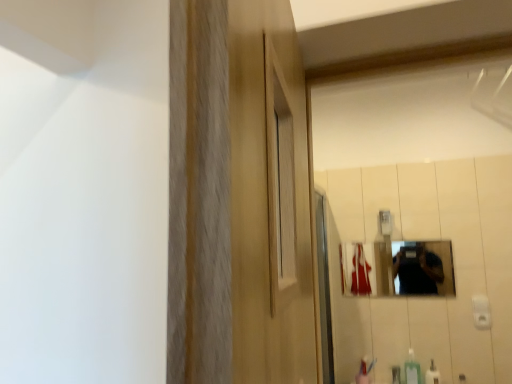
Measure the distance between point (435, 373) and camera.

The distance of point (435, 373) from camera is 2.25 meters.

Describe the element at coordinates (412, 369) in the screenshot. I see `green plastic soap dispenser at lower right` at that location.

Describe the element at coordinates (423, 268) in the screenshot. I see `metallic reflective mirror at center` at that location.

The height and width of the screenshot is (384, 512). Find the location of `white glossy bottle at lower right`. white glossy bottle at lower right is located at coordinates (432, 374).

Which of these two, white glossy bottle at lower right or metallic reflective mirror at center, is bigger?

Bigger between the two is metallic reflective mirror at center.

What's the angular difference between white glossy bottle at lower right and metallic reflective mirror at center's facing directions?

There is a 0.397-degree angle between the facing directions of white glossy bottle at lower right and metallic reflective mirror at center.

Is white glossy bottle at lower right at the left side of metallic reflective mirror at center?

Incorrect, white glossy bottle at lower right is not on the left side of metallic reflective mirror at center.

This screenshot has height=384, width=512. What are the coordinates of `mouthwash that is on the right side of metallic reflective mirror at center` in the screenshot? It's located at pos(432,374).

Could you measure the distance between metallic reflective mirror at center and green plastic soap dispenser at lower right?

17.81 inches.

From a real-world perspective, relative to green plastic soap dispenser at lower right, is metallic reflective mirror at center vertically above or below?

metallic reflective mirror at center is above green plastic soap dispenser at lower right.

Looking at this image, how different are the orientations of metallic reflective mirror at center and green plastic soap dispenser at lower right in degrees?

metallic reflective mirror at center and green plastic soap dispenser at lower right are facing 0.397 degrees away from each other.

Between metallic reflective mirror at center and green plastic soap dispenser at lower right, which one appears on the left side from the viewer's perspective?

metallic reflective mirror at center.

Between green plastic soap dispenser at lower right and white glossy bottle at lower right, which one has larger width?

With larger width is white glossy bottle at lower right.

Which is closer, (416, 373) or (435, 374)?

The point (416, 373) is closer.

From the image's perspective, between green plastic soap dispenser at lower right and white glossy bottle at lower right, which one is located above?

green plastic soap dispenser at lower right appears higher in the image.

From the image's perspective, between green plastic soap dispenser at lower right and metallic reflective mirror at center, which one is located above?

From the image's view, metallic reflective mirror at center is above.

Is green plastic soap dispenser at lower right turned away from metallic reflective mirror at center?

green plastic soap dispenser at lower right is not turned away from metallic reflective mirror at center.

From a real-world perspective, who is located lower, green plastic soap dispenser at lower right or metallic reflective mirror at center?

green plastic soap dispenser at lower right.

Measure the distance from green plastic soap dispenser at lower right to metallic reflective mirror at center.

green plastic soap dispenser at lower right is 17.81 inches from metallic reflective mirror at center.

Is white glossy bottle at lower right directly adjacent to green plastic soap dispenser at lower right?

Yes, white glossy bottle at lower right is with green plastic soap dispenser at lower right.

Is green plastic soap dispenser at lower right at the back of white glossy bottle at lower right?

No.

What's the angular difference between white glossy bottle at lower right and green plastic soap dispenser at lower right's facing directions?

The angle between the facing direction of white glossy bottle at lower right and the facing direction of green plastic soap dispenser at lower right is 0.00294 degrees.

From the image's perspective, between white glossy bottle at lower right and green plastic soap dispenser at lower right, who is located below?

white glossy bottle at lower right, from the image's perspective.

Would you say metallic reflective mirror at center contains white glossy bottle at lower right?

No, white glossy bottle at lower right is not surrounded by metallic reflective mirror at center.

Does point (442, 259) come farther from viewer compared to point (428, 370)?

Yes, point (442, 259) is behind point (428, 370).

Are metallic reflective mirror at center and white glossy bottle at lower right beside each other?

metallic reflective mirror at center and white glossy bottle at lower right are clearly separated.

Is metallic reflective mirror at center wider than white glossy bottle at lower right?

In fact, metallic reflective mirror at center might be narrower than white glossy bottle at lower right.

Find the location of a particular element. The width and height of the screenshot is (512, 384). mouthwash on the right of the metallic reflective mirror at center is located at coordinates (432, 374).

Image resolution: width=512 pixels, height=384 pixels. In order to click on soap dispenser located in front of the metallic reflective mirror at center in this screenshot , I will do `click(412, 369)`.

Considering their positions, is metallic reflective mirror at center positioned closer to white glossy bottle at lower right than green plastic soap dispenser at lower right?

Among the two, green plastic soap dispenser at lower right is located nearer to white glossy bottle at lower right.

Looking at the image, which one is located closer to green plastic soap dispenser at lower right, white glossy bottle at lower right or metallic reflective mirror at center?

white glossy bottle at lower right is closer to green plastic soap dispenser at lower right.

Estimate the real-world distances between objects in this image. Which object is further from green plastic soap dispenser at lower right, metallic reflective mirror at center or white glossy bottle at lower right?

metallic reflective mirror at center is positioned further to the anchor green plastic soap dispenser at lower right.

Looking at the image, which one is located further to metallic reflective mirror at center, white glossy bottle at lower right or green plastic soap dispenser at lower right?

white glossy bottle at lower right is further to metallic reflective mirror at center.

Which object lies further to the anchor point metallic reflective mirror at center, green plastic soap dispenser at lower right or white glossy bottle at lower right?

white glossy bottle at lower right.

Based on the photo, estimate the real-world distances between objects in this image. Which object is further from white glossy bottle at lower right, green plastic soap dispenser at lower right or metallic reflective mirror at center?

The object further to white glossy bottle at lower right is metallic reflective mirror at center.

Locate an element on the screen. soap dispenser that lies between metallic reflective mirror at center and white glossy bottle at lower right from top to bottom is located at coordinates (412, 369).